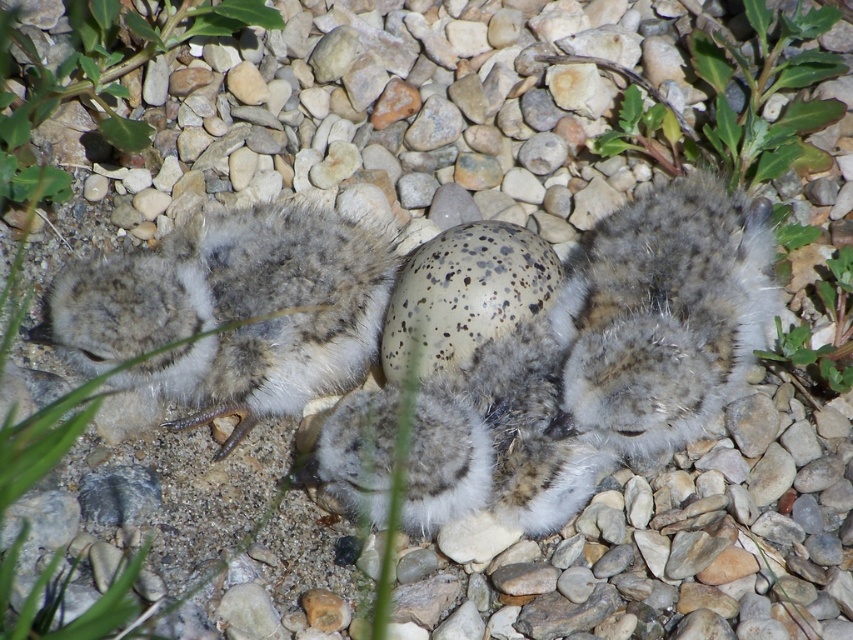
Question: Which point is closer to the camera taking this photo?

Choices:
 (A) (289, 362)
 (B) (611, 296)

Answer: (B)

Question: Which point is closer to the camera taking this photo?

Choices:
 (A) (202, 326)
 (B) (668, 352)

Answer: (B)

Question: Is soft gray downy chick at center thinner than fuzzy gray bird at center?

Choices:
 (A) yes
 (B) no

Answer: (B)

Question: Is soft gray downy chick at center further to camera compared to fuzzy gray bird at center?

Choices:
 (A) yes
 (B) no

Answer: (A)

Question: Which point is farther from the camera taking this photo?

Choices:
 (A) (634, 458)
 (B) (293, 332)

Answer: (A)

Question: Is soft gray downy chick at center to the right of fuzzy gray bird at center from the viewer's perspective?

Choices:
 (A) yes
 (B) no

Answer: (B)